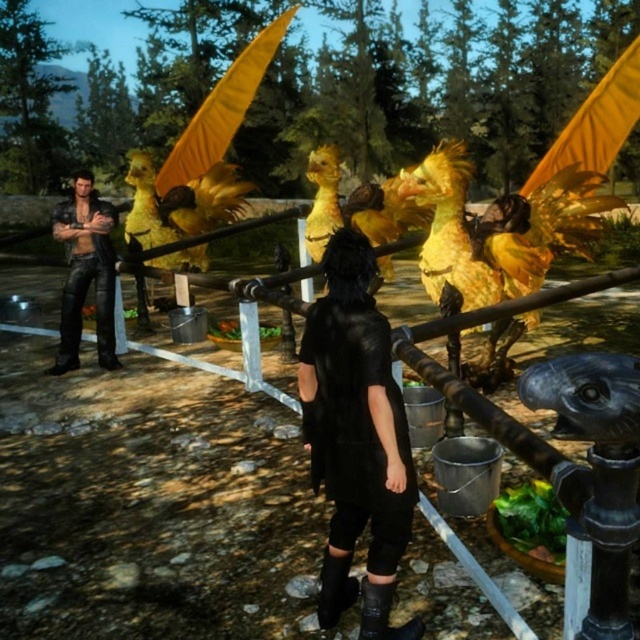
Question: Which of the following is the closest to the observer?

Choices:
 (A) black matte dress at center
 (B) leather jacket at left

Answer: (A)

Question: In this image, where is black matte dress at center located relative to leather jacket at left?

Choices:
 (A) below
 (B) above

Answer: (A)

Question: Which point appears farthest from the camera in this image?

Choices:
 (A) (349, 506)
 (B) (115, 218)

Answer: (B)

Question: Does black matte dress at center have a lesser width compared to leather jacket at left?

Choices:
 (A) yes
 (B) no

Answer: (A)

Question: Is black matte dress at center in front of leather jacket at left?

Choices:
 (A) no
 (B) yes

Answer: (B)